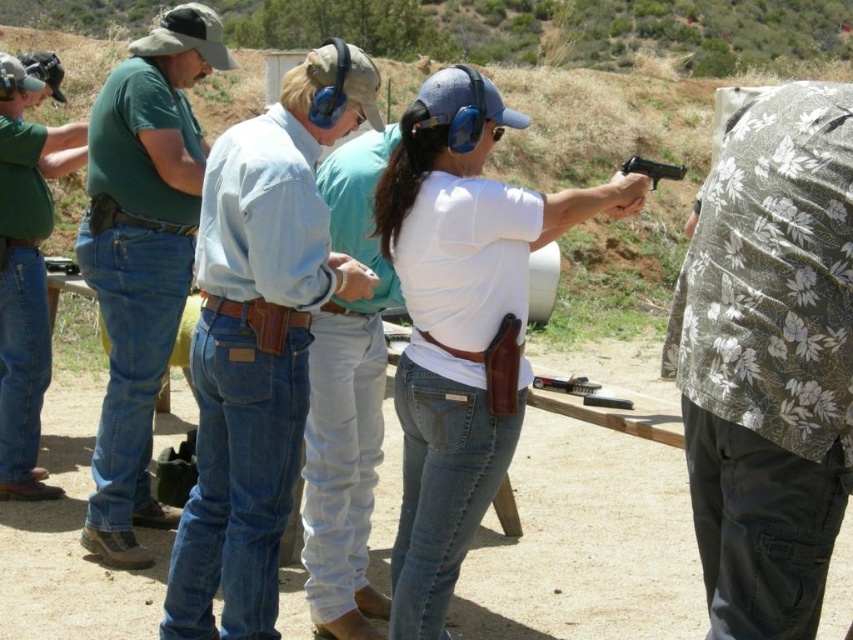
Question: Which point appears closest to the camera in this image?

Choices:
 (A) (25, 305)
 (B) (350, 58)
 (C) (780, 584)

Answer: (C)

Question: Is denim jeans at center below black plastic handgun at center?

Choices:
 (A) yes
 (B) no

Answer: (A)

Question: Is floral fabric shirt at right closer to the viewer compared to white matte shirt at center?

Choices:
 (A) yes
 (B) no

Answer: (A)

Question: Which point is closer to the camera?

Choices:
 (A) denim jeans at center
 (B) green cotton shirt at left
 (C) brushed metal water at left

Answer: (A)

Question: Among these points, which one is nearest to the camera?

Choices:
 (A) (123, 346)
 (B) (834, 468)

Answer: (B)

Question: Is denim jeans at center to the right of white matte shirt at center from the viewer's perspective?

Choices:
 (A) no
 (B) yes

Answer: (A)